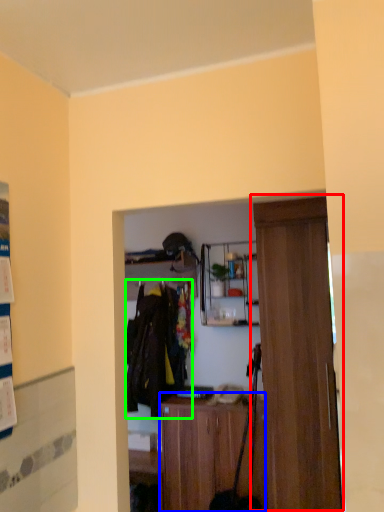
Question: Considering the real-world distances, which object is farthest from door (highlighted by a red box)? cabinetry (highlighted by a blue box) or clothing (highlighted by a green box)?

Choices:
 (A) cabinetry
 (B) clothing

Answer: (B)